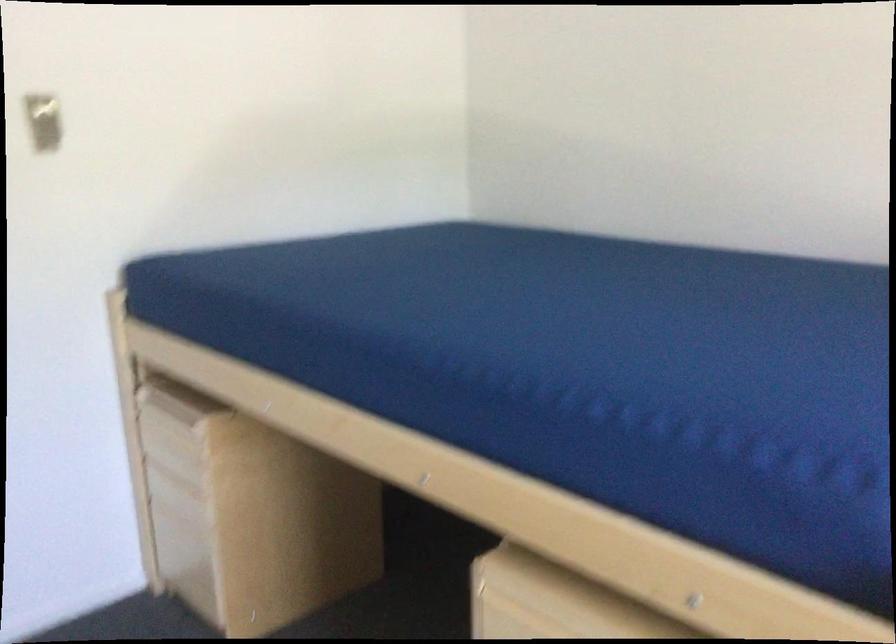
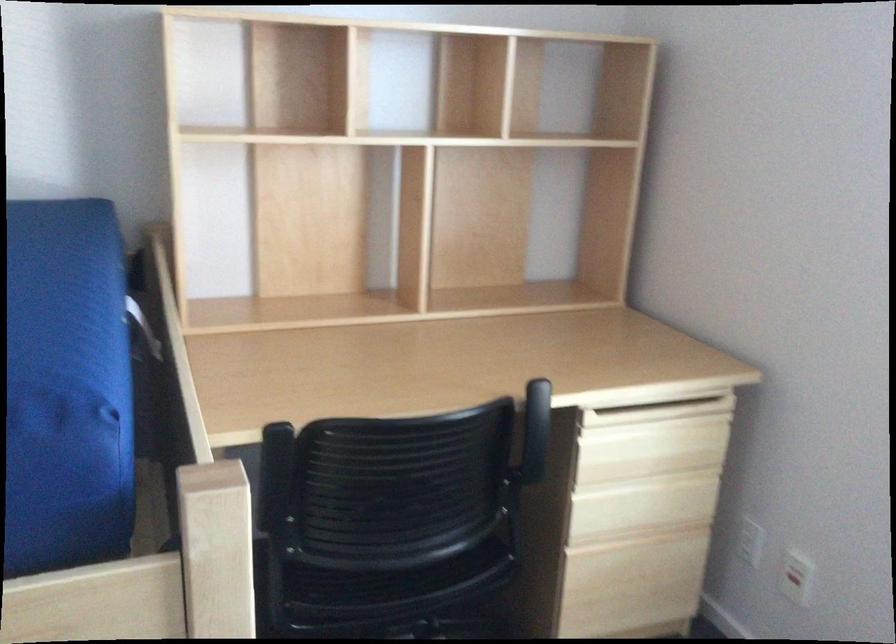
Question: The first image is from the beginning of the video and the second image is from the end. How did the camera likely rotate when shooting the video?

Choices:
 (A) Left
 (B) Right
 (C) Up
 (D) Down

Answer: (B)